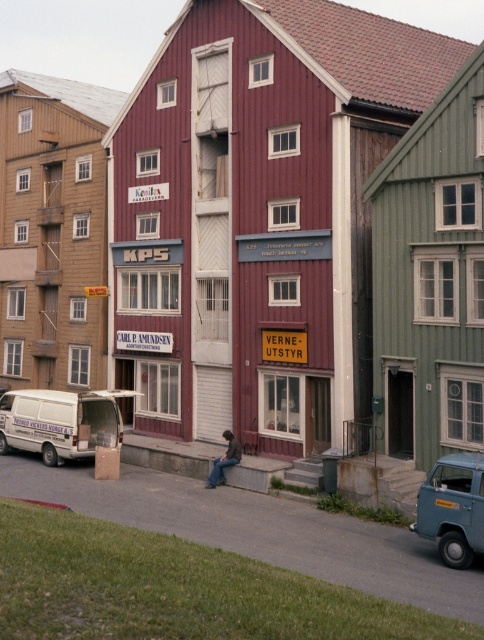
You are a delivery person who needs to park your white matte van at lower left near the gray concrete curb at lower center. Can you safely park the van so that it is directly in front of the curb?

The gray concrete curb at lower center is behind the white matte van at lower left, so the van is already positioned behind the curb. To park directly in front of the curb, you would need to move the van forward so it is in front of the curb instead of behind it.

You are a delivery person standing on the gray concrete curb at lower center and need to place a large package next to the dark blue jeans at center. Can you fit the package between them without moving either object?

The gray concrete curb at lower center is bigger than the dark blue jeans at center, so there might not be enough space between them to fit the large package without moving either object.